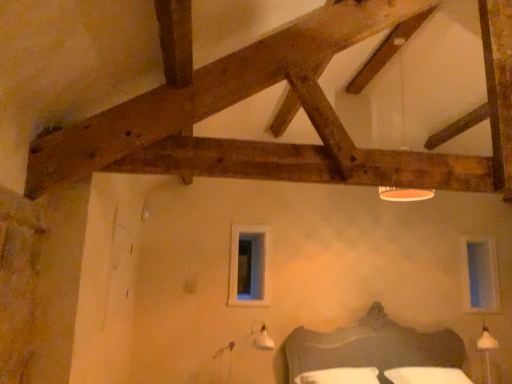
Question: Does white cotton bedding at lower center appear on the left side of clear glass window at upper right, which is the second window from front to back?

Choices:
 (A) yes
 (B) no

Answer: (A)

Question: Is white cotton bedding at lower center facing towards clear glass window at upper right, acting as the 2th window starting from the left?

Choices:
 (A) yes
 (B) no

Answer: (B)

Question: Is the position of white cotton bedding at lower center less distant than that of clear glass window at upper right, which is the 1th window in back-to-front order?

Choices:
 (A) yes
 (B) no

Answer: (A)

Question: Are white cotton bedding at lower center and clear glass window at upper right, which is the second window from front to back, making contact?

Choices:
 (A) no
 (B) yes

Answer: (A)

Question: From a real-world perspective, is white cotton bedding at lower center positioned over clear glass window at upper right, which is the 1th window in back-to-front order, based on gravity?

Choices:
 (A) no
 (B) yes

Answer: (A)

Question: Considering the positions of point 417,367 and point 260,292, is point 417,367 closer or farther from the camera than point 260,292?

Choices:
 (A) closer
 (B) farther

Answer: (A)

Question: Considering the positions of white cotton bedding at lower center and clear glass window at center, which is the first window from left to right, in the image, is white cotton bedding at lower center taller or shorter than clear glass window at center, which is the first window from left to right,?

Choices:
 (A) short
 (B) tall

Answer: (A)

Question: Looking at their shapes, would you say white cotton bedding at lower center is wider or thinner than clear glass window at center, which is the first window from left to right?

Choices:
 (A) thin
 (B) wide

Answer: (B)

Question: Visually, is white cotton bedding at lower center positioned to the left or to the right of clear glass window at center, the 1th window viewed from the front?

Choices:
 (A) right
 (B) left

Answer: (A)

Question: Is white plastic lampshade at upper center to the left or to the right of white cotton bedding at lower center in the image?

Choices:
 (A) left
 (B) right

Answer: (B)

Question: In the image, is white plastic lampshade at upper center positioned in front of or behind white cotton bedding at lower center?

Choices:
 (A) front
 (B) behind

Answer: (B)

Question: From the image's perspective, relative to white cotton bedding at lower center, is white plastic lampshade at upper center above or below?

Choices:
 (A) below
 (B) above

Answer: (B)

Question: Is white plastic lampshade at upper center wider or thinner than white cotton bedding at lower center?

Choices:
 (A) thin
 (B) wide

Answer: (A)

Question: In terms of height, does white cotton bedding at lower center look taller or shorter compared to white plastic lampshade at upper center?

Choices:
 (A) tall
 (B) short

Answer: (B)

Question: Is point (377, 382) closer or farther from the camera than point (401, 41)?

Choices:
 (A) farther
 (B) closer

Answer: (A)